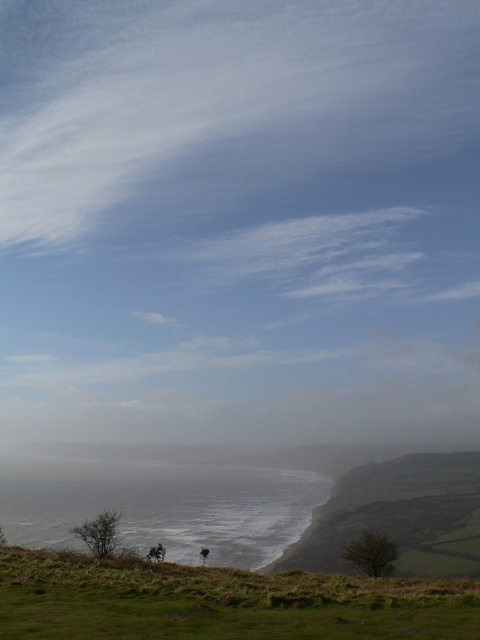
Question: Which point is closer to the camera?

Choices:
 (A) gray matte water at center
 (B) white cotton cloud at upper center
 (C) green grassy at lower center

Answer: (C)

Question: Which point is closer to the camera taking this photo?

Choices:
 (A) (85, 474)
 (B) (471, 508)

Answer: (B)

Question: Does green grassy at lower center have a greater width compared to green grassy hillside at lower right?

Choices:
 (A) yes
 (B) no

Answer: (B)

Question: Is white cotton cloud at upper center closer to the viewer compared to gray matte water at center?

Choices:
 (A) no
 (B) yes

Answer: (A)

Question: Considering the real-world distances, which object is farthest from the green grassy hillside at lower right?

Choices:
 (A) white cotton cloud at upper center
 (B) gray matte water at center

Answer: (A)

Question: Is white cotton cloud at upper center in front of green grassy hillside at lower right?

Choices:
 (A) yes
 (B) no

Answer: (B)